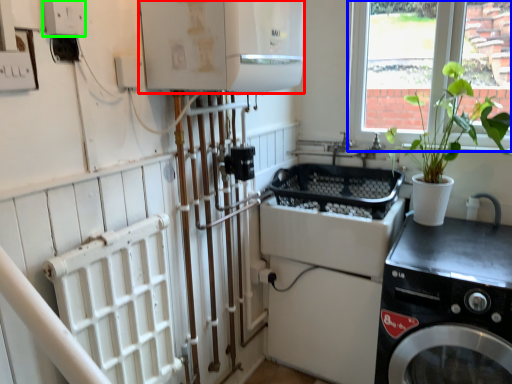
Question: Estimate the real-world distances between objects in this image. Which object is farther from appliance (highlighted by a red box), window (highlighted by a blue box) or electric outlet (highlighted by a green box)?

Choices:
 (A) window
 (B) electric outlet

Answer: (A)